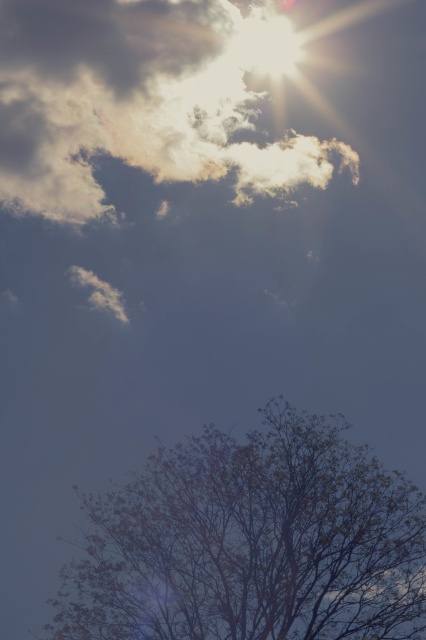
You are an artist sketching the scene and want to ensure the proportions are accurate. Which object should you draw first, the bare branches at lower right or the white fluffy cloud at upper center, if you want to start with the larger one?

The bare branches at lower right is larger in size than the white fluffy cloud at upper center, so you should start by drawing the bare branches at lower right first.

You are an astronomer observing the sky and notice the bare branches at lower right and the white fluffy cloud at upper center. Which object is positioned higher in the sky?

The white fluffy cloud at upper center is positioned higher in the sky than the bare branches at lower right.

You are observing the sky scene and want to determine which of the two points, point (161, 554) or point (216, 115), is closer to you. Based on the scene description, which point is nearer?

Point (161, 554) is closer to the viewer than point (216, 115).